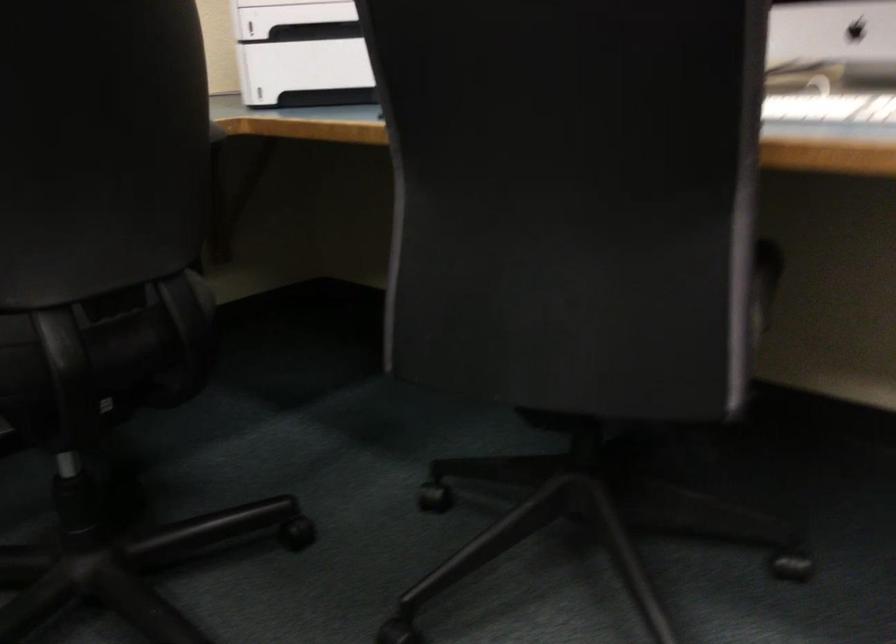
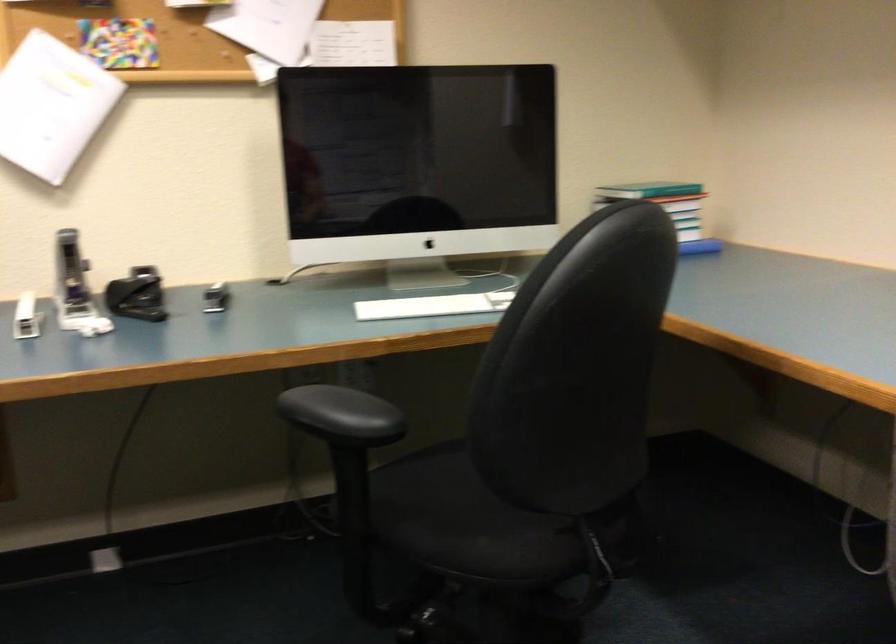
Question: Based on the continuous images, in which direction is the camera rotating? Reply with the corresponding letter.

Choices:
 (A) Left
 (B) Right
 (C) Up
 (D) Down

Answer: (B)